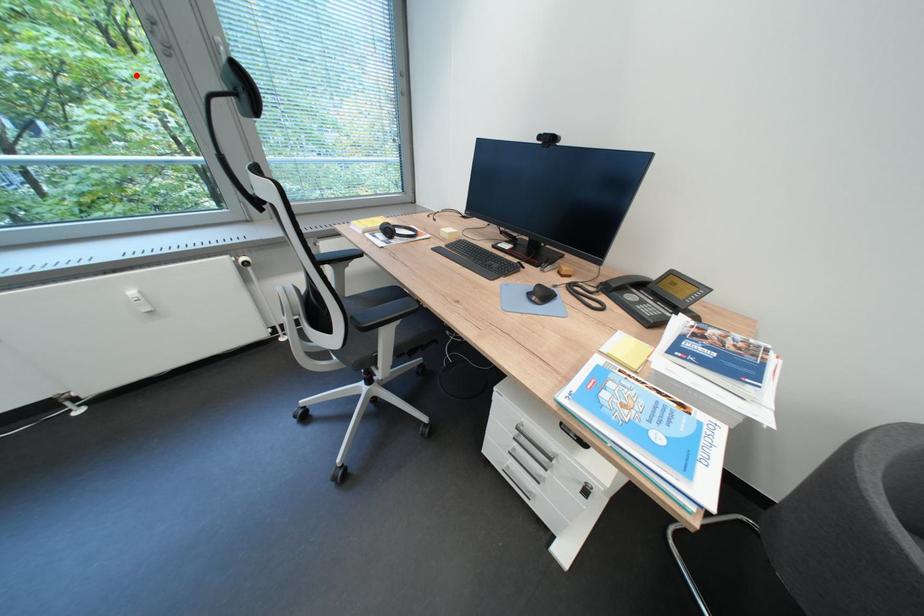
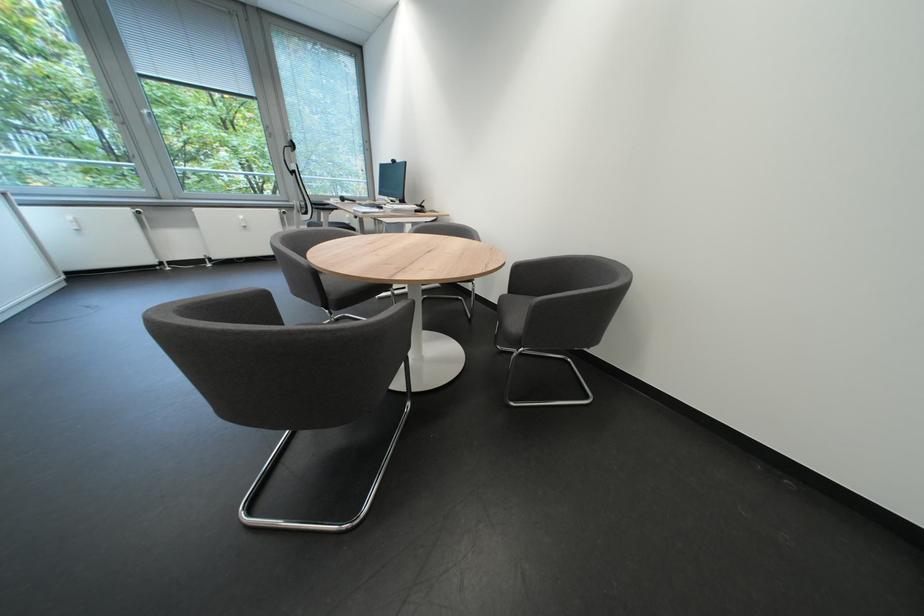
Find the pixel in the second image that matches the highlighted location in the first image.

(248, 146)